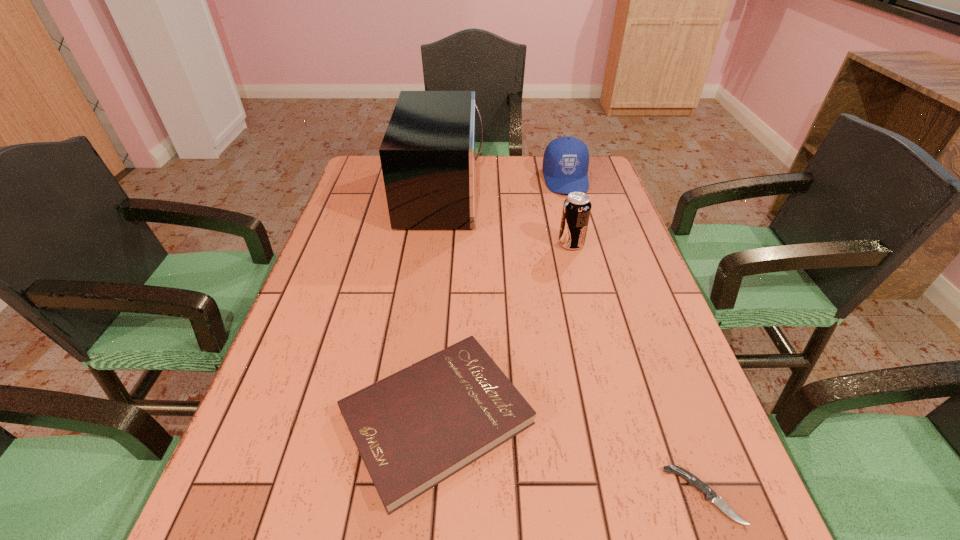
At what (x,y) coordinates should I click in order to perform the action: click on microwave oven that is at the far edge. Please return your answer as a coordinate pair (x, y). The height and width of the screenshot is (540, 960). Looking at the image, I should click on (428, 157).

The height and width of the screenshot is (540, 960). In order to click on cap located at the far edge in this screenshot , I will do pos(565,165).

Identify the location of object that is at the left edge. (414, 429).

Where is `soda can that is positioned at the right edge`? This screenshot has height=540, width=960. soda can that is positioned at the right edge is located at coordinates (576, 211).

This screenshot has width=960, height=540. I want to click on cap that is at the right edge, so click(x=565, y=165).

This screenshot has height=540, width=960. I want to click on pocketknife that is at the right edge, so click(x=710, y=495).

Locate an element on the screen. The image size is (960, 540). object that is at the far right corner is located at coordinates (565, 165).

Identify the location of vacant space at the far edge. Image resolution: width=960 pixels, height=540 pixels. (484, 187).

Image resolution: width=960 pixels, height=540 pixels. I want to click on vacant region at the left edge, so click(x=369, y=304).

Identify the location of vacant area at the right edge. (611, 273).